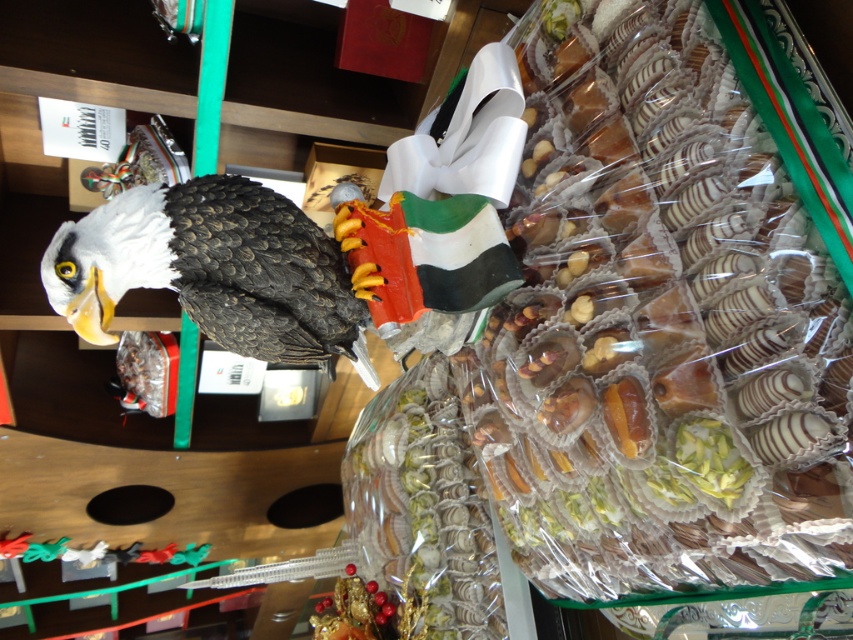
Question: Which point appears farthest from the camera in this image?

Choices:
 (A) (846, 147)
 (B) (254, 330)

Answer: (B)

Question: Is translucent plastic confections at right to the left of shiny black eagle at left from the viewer's perspective?

Choices:
 (A) no
 (B) yes

Answer: (A)

Question: Which of the following is the closest to the observer?

Choices:
 (A) (579, 289)
 (B) (132, 272)

Answer: (B)

Question: Is translucent plastic confections at right positioned at the back of shiny black eagle at left?

Choices:
 (A) yes
 (B) no

Answer: (B)

Question: Does translucent plastic confections at right have a lesser width compared to shiny black eagle at left?

Choices:
 (A) no
 (B) yes

Answer: (B)

Question: Which object appears farthest from the camera in this image?

Choices:
 (A) shiny black eagle at left
 (B) translucent plastic confections at right

Answer: (A)